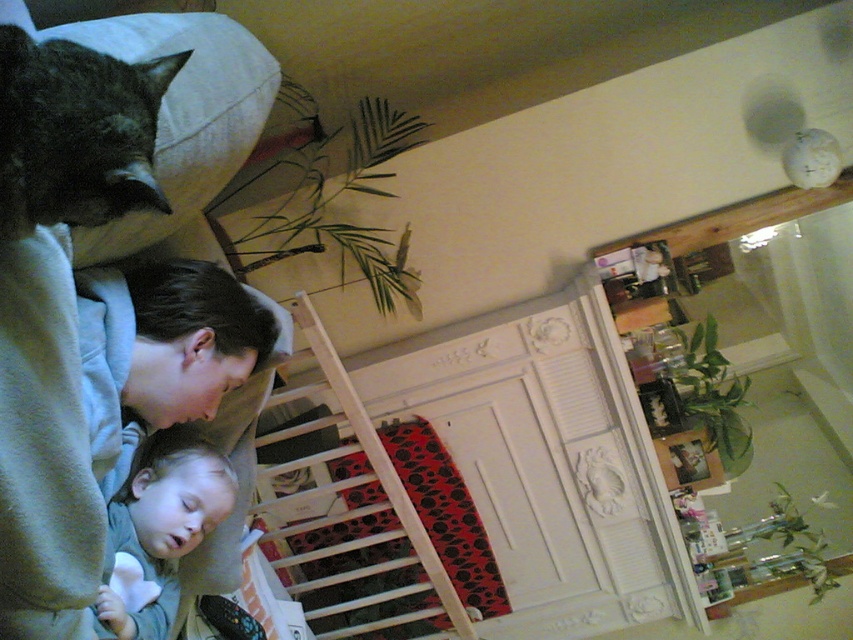
Question: Which object is farther from the camera taking this photo?

Choices:
 (A) gray fur cat at upper left
 (B) soft gray fabric at lower left

Answer: (B)

Question: Which point is farther to the camera?

Choices:
 (A) pyautogui.click(x=12, y=221)
 (B) pyautogui.click(x=148, y=596)

Answer: (B)

Question: Does gray fur cat at upper left appear over soft gray fabric at lower left?

Choices:
 (A) no
 (B) yes

Answer: (B)

Question: In this image, where is gray fur cat at upper left located relative to soft gray fabric at lower left?

Choices:
 (A) right
 (B) left

Answer: (A)

Question: Is gray fur cat at upper left to the left of soft gray fabric at lower left from the viewer's perspective?

Choices:
 (A) no
 (B) yes

Answer: (A)